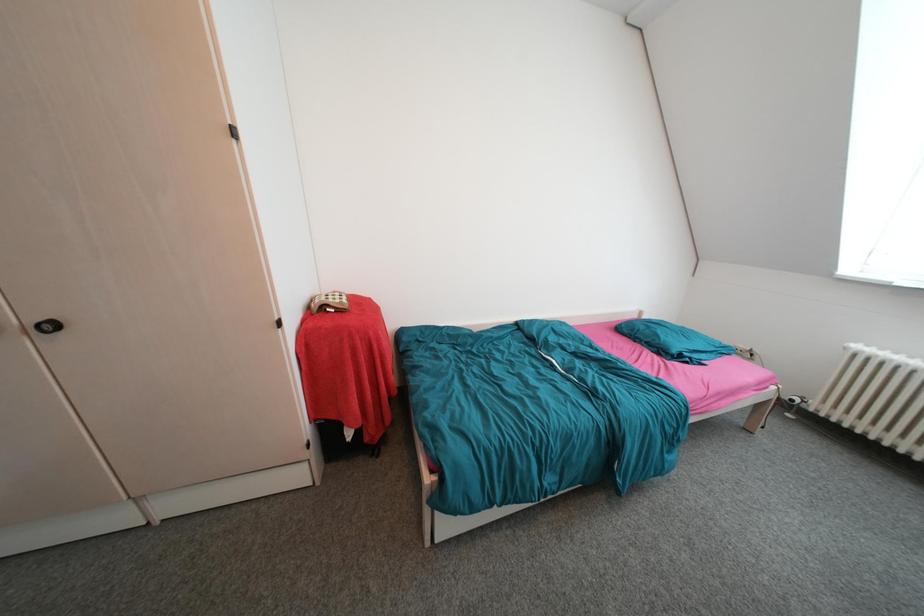
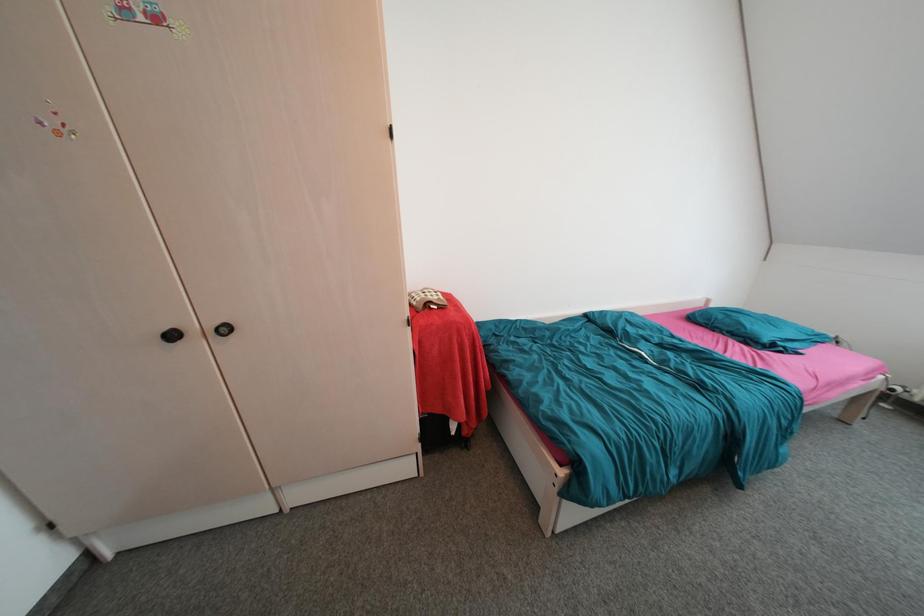
Question: In a continuous first-person perspective shot, in which direction is the camera moving?

Choices:
 (A) Left
 (B) Right
 (C) Forward
 (D) Backward

Answer: (A)